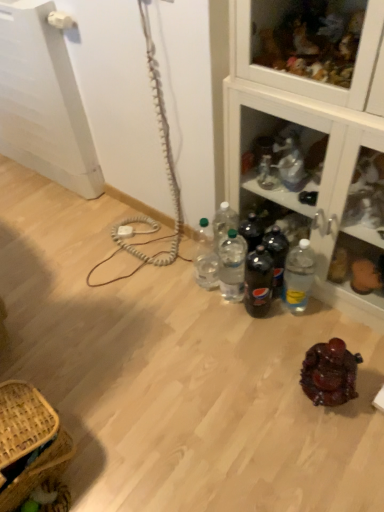
Identify the location of vacant area that lies between clear plastic bottles at center, the first bottle in the left-to-right sequence, and shiny brown candy at center. (265, 337).